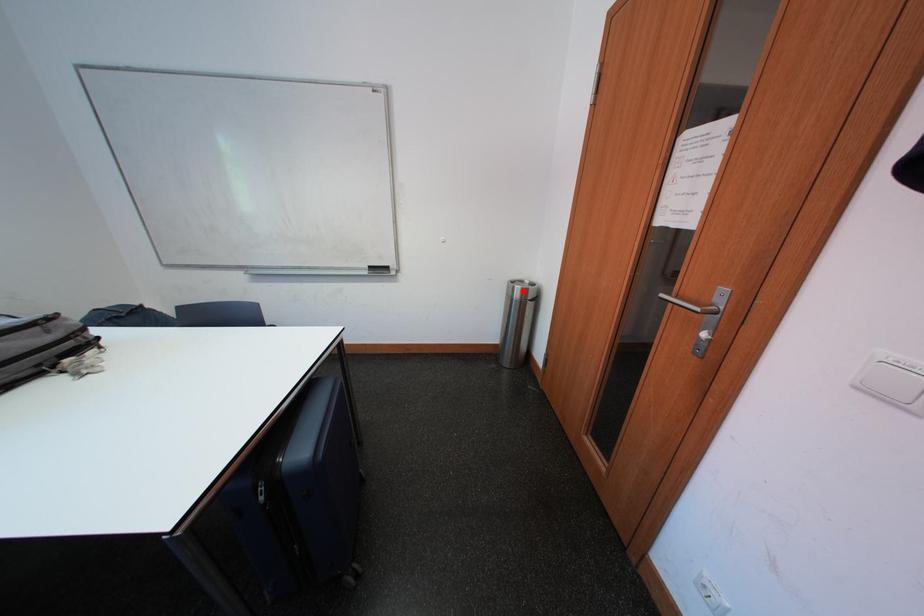
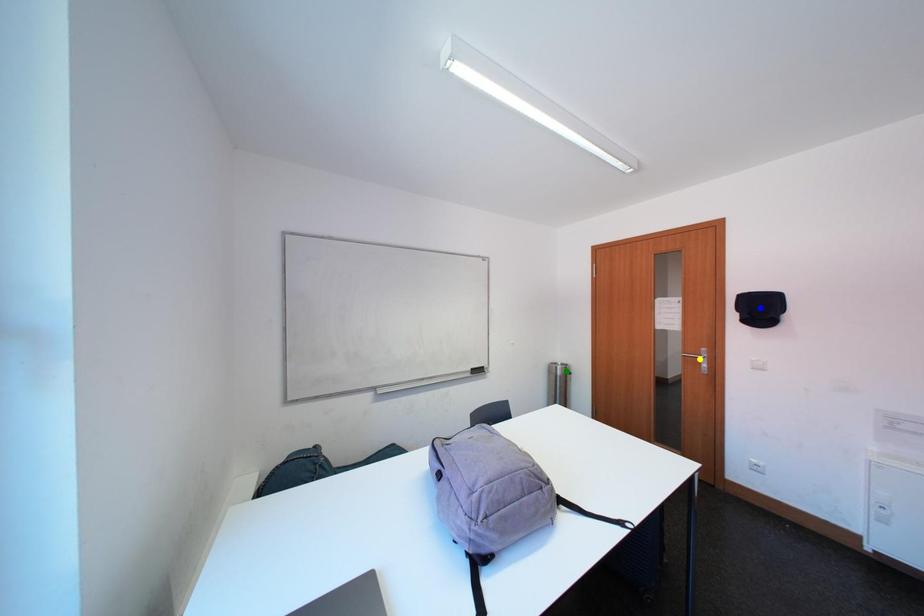
Question: I am providing you with two images of the same scene from different viewpoints. A red point is marked on the first image. You are given multiple points on the second image. Which point in image 2 is actually the same real-world point as the red point in image 1?

Choices:
 (A) green point
 (B) yellow point
 (C) blue point

Answer: (A)